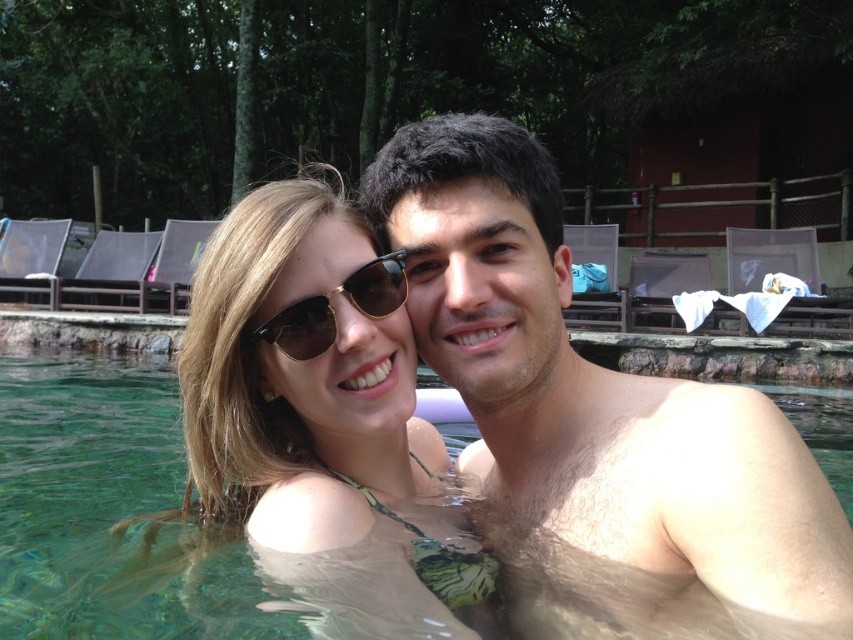
Measure the distance between point (x=612, y=426) and camera.

Point (x=612, y=426) and camera are 1.43 meters apart.

Between point (766, 474) and point (152, 531), which one is positioned behind?

Positioned behind is point (152, 531).

Does point (724, 573) come in front of point (383, 611)?

Yes.

You are a GUI agent. You are given a task and a screenshot of the screen. Output one action in this format:
    pyautogui.click(x=<x>, y=<y>)
    Task: Click on the smooth skin man at center
    This screenshot has width=853, height=640.
    Given the screenshot: What is the action you would take?
    pyautogui.click(x=592, y=388)

Is smooth skin man at center to the right of matte gold sunglasses at center from the viewer's perspective?

Indeed, smooth skin man at center is positioned on the right side of matte gold sunglasses at center.

Is smooth skin man at center above matte gold sunglasses at center?

Actually, smooth skin man at center is below matte gold sunglasses at center.

Who is more forward, (639, 400) or (332, 376)?

Positioned in front is point (332, 376).

You are a GUI agent. You are given a task and a screenshot of the screen. Output one action in this format:
    pyautogui.click(x=<x>, y=<y>)
    Task: Click on the smooth skin man at center
    The width and height of the screenshot is (853, 640).
    Given the screenshot: What is the action you would take?
    pyautogui.click(x=592, y=388)

Looking at this image, who is more distant from viewer, (787, 584) or (276, 337)?

Positioned behind is point (276, 337).

Is smooth skin man at center thinner than gold-framed sunglasses at center?

Incorrect, smooth skin man at center's width is not less than gold-framed sunglasses at center's.

Does point (438, 164) lie behind point (285, 336)?

Yes, it is.

Where is `smooth skin man at center`? The height and width of the screenshot is (640, 853). smooth skin man at center is located at coordinates (592, 388).